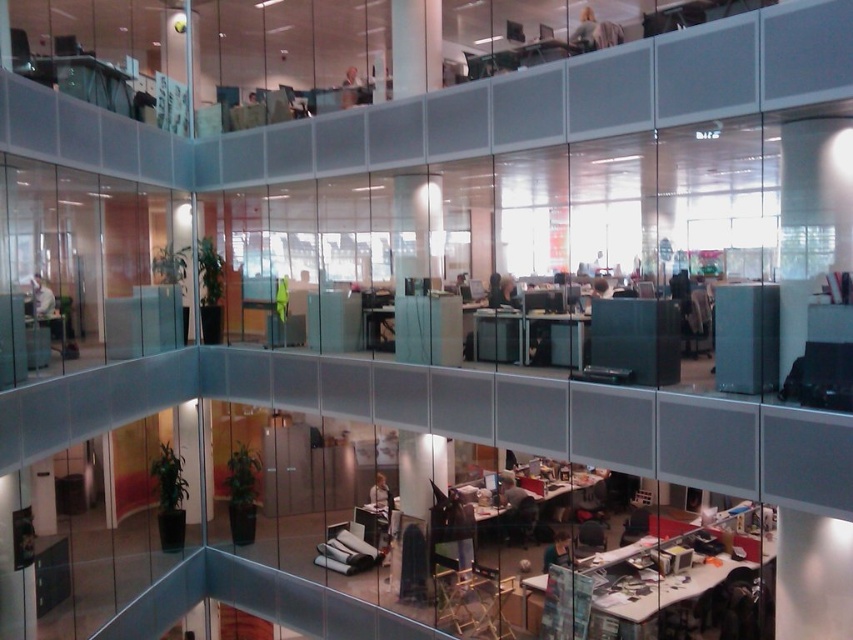
Who is more distant from viewer, (592, 531) or (640, 524)?

Positioned behind is point (640, 524).

Which is below, black leather chair at lower center or metallic gray chair at lower right?

black leather chair at lower center is below.

Find the location of a particular element. The height and width of the screenshot is (640, 853). black leather chair at lower center is located at coordinates (590, 536).

Identify the location of black leather chair at lower center. (590, 536).

Does metallic silver chair at lower center appear over metallic gray chair at lower right?

Correct, metallic silver chair at lower center is located above metallic gray chair at lower right.

Who is more distant from viewer, (529, 506) or (640, 515)?

Positioned behind is point (529, 506).

Where is `metallic silver chair at lower center`? metallic silver chair at lower center is located at coordinates (520, 520).

Find the location of a particular element. The height and width of the screenshot is (640, 853). metallic silver chair at lower center is located at coordinates (520, 520).

Does metallic silver chair at lower center have a lesser height compared to matte black chair at lower center?

Incorrect, metallic silver chair at lower center's height does not fall short of matte black chair at lower center's.

Who is positioned more to the right, metallic silver chair at lower center or matte black chair at lower center?

From the viewer's perspective, matte black chair at lower center appears more on the right side.

Which is behind, point (531, 515) or point (579, 504)?

The point (579, 504) is behind.

I want to click on metallic silver chair at lower center, so click(520, 520).